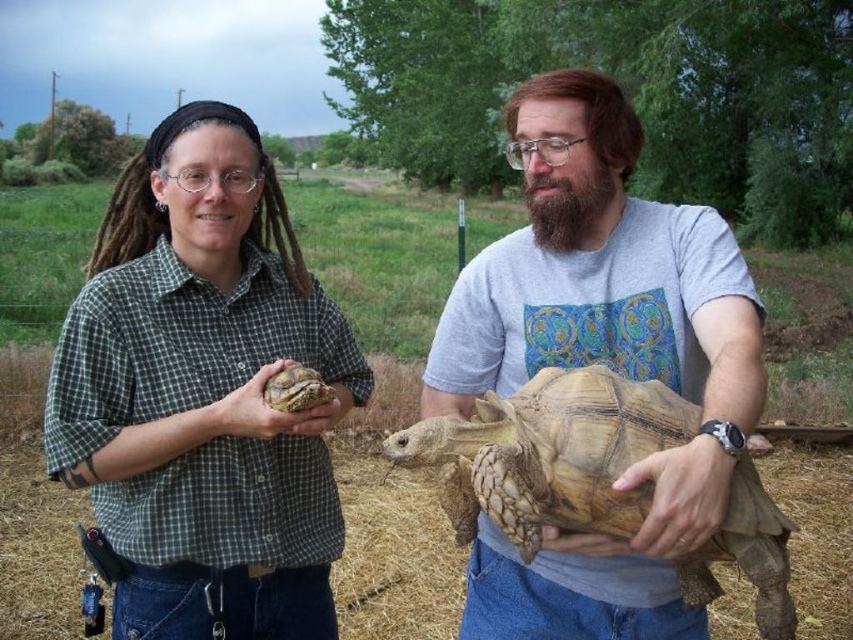
Question: Among these objects, which one is farthest from the camera?

Choices:
 (A) brown rough skin at lower right
 (B) green checkered shirt at center
 (C) matte gray t-shirt at center
 (D) leathery brown tortoise at center

Answer: (B)

Question: Does matte gray t-shirt at center have a larger size compared to matte brown tortoise at center?

Choices:
 (A) no
 (B) yes

Answer: (B)

Question: Which object is farther from the camera taking this photo?

Choices:
 (A) green checkered shirt at center
 (B) matte brown tortoise at center
 (C) leathery brown tortoise at center
 (D) matte gray t-shirt at center

Answer: (A)

Question: Is matte gray t-shirt at center in front of brown rough skin at lower right?

Choices:
 (A) yes
 (B) no

Answer: (B)

Question: Does matte gray t-shirt at center appear under brown rough skin at lower right?

Choices:
 (A) no
 (B) yes

Answer: (A)

Question: Which of the following is the closest to the observer?

Choices:
 (A) (218, 486)
 (B) (529, 577)
 (C) (675, 497)

Answer: (C)